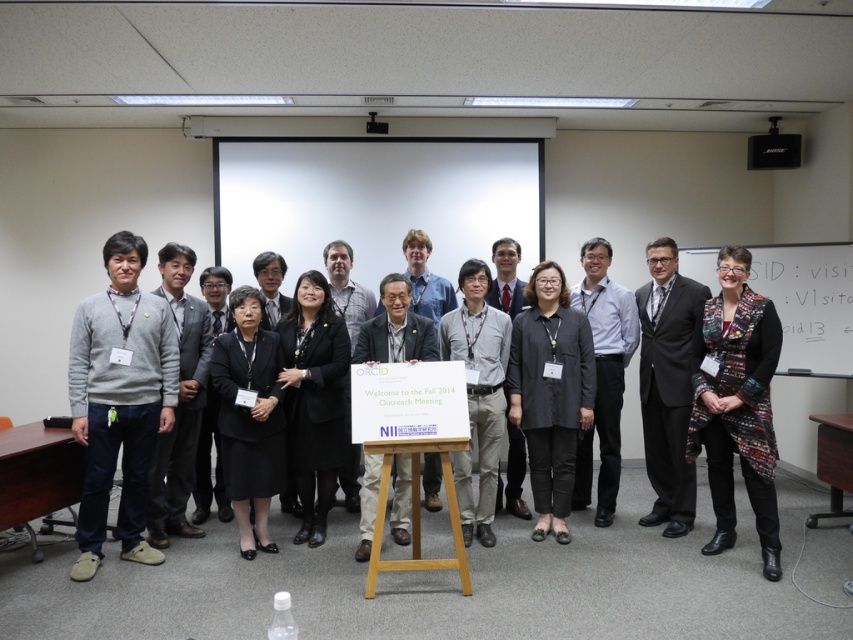
Between black matte blazer at center and black suit at center, which one appears on the right side from the viewer's perspective?

black suit at center

Who is shorter, black matte blazer at center or black suit at center?

black matte blazer at center is shorter.

The image size is (853, 640). What do you see at coordinates (550, 392) in the screenshot? I see `black matte blazer at center` at bounding box center [550, 392].

In order to click on black matte blazer at center in this screenshot , I will do `click(550, 392)`.

How far apart are black suit at center and light gray shirt at center?

A distance of 11.25 inches exists between black suit at center and light gray shirt at center.

Is black suit at center above light gray shirt at center?

Incorrect, black suit at center is not positioned above light gray shirt at center.

Describe the element at coordinates (666, 385) in the screenshot. The height and width of the screenshot is (640, 853). I see `black suit at center` at that location.

Locate an element on the screen. This screenshot has width=853, height=640. black suit at center is located at coordinates (666, 385).

Consider the image. Does gray sweater at left appear on the right side of black matte blazer at center?

Incorrect, gray sweater at left is not on the right side of black matte blazer at center.

Can you confirm if gray sweater at left is taller than black matte blazer at center?

Correct, gray sweater at left is much taller as black matte blazer at center.

The width and height of the screenshot is (853, 640). What are the coordinates of `gray sweater at left` in the screenshot? It's located at (119, 400).